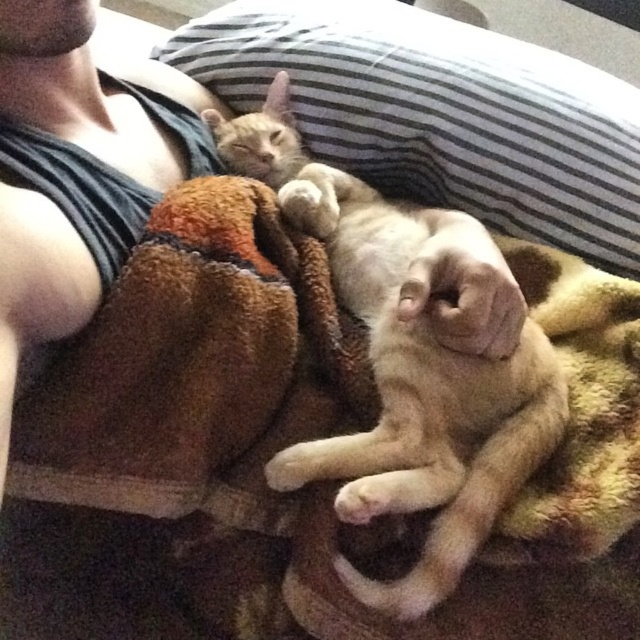
You are holding a 20 inch long toy mouse and want to place it on the brown fuzzy blanket at center without stepping closer. Can you reach it?

The brown fuzzy blanket at center is 19.24 inches away from the viewer. Since the toy mouse is 20 inches long, you can extend it to reach the blanket as the distance is slightly shorter than the toy mouse length.

You are a cat owner who wants to place a new toy for your cats. The cats are currently resting at point (234, 458). Where should you place the toy so that it is not on the brown fuzzy blanket at center?

The brown fuzzy blanket at center is located at point (234, 458). To avoid placing the toy on it, you should choose a different location away from that coordinate.

You are a cat owner who wants to place a small toy between the two cats without disturbing them. The coordinates for the center of the area where you can safely place the toy are given as point (234, 458). According to the scene description, where exactly is this point located?

The point (234, 458) is located on the brown fuzzy blanket at center, making it a safe spot to place the toy without disturbing the cats.